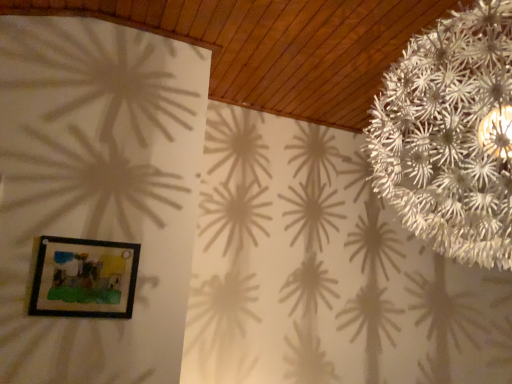
Question: Considering their positions, is wooden framed picture at lower left located in front of or behind white paper flower at upper right?

Choices:
 (A) front
 (B) behind

Answer: (B)

Question: From a real-world perspective, is wooden framed picture at lower left positioned above or below white paper flower at upper right?

Choices:
 (A) below
 (B) above

Answer: (A)

Question: Visually, is wooden framed picture at lower left positioned to the left or to the right of white paper flower at upper right?

Choices:
 (A) left
 (B) right

Answer: (A)

Question: Relative to wooden framed picture at lower left, is white paper flower at upper right in front or behind?

Choices:
 (A) front
 (B) behind

Answer: (A)

Question: In terms of width, does white paper flower at upper right look wider or thinner when compared to wooden framed picture at lower left?

Choices:
 (A) thin
 (B) wide

Answer: (B)

Question: Is white paper flower at upper right to the left or to the right of wooden framed picture at lower left in the image?

Choices:
 (A) right
 (B) left

Answer: (A)

Question: From the image's perspective, is white paper flower at upper right positioned above or below wooden framed picture at lower left?

Choices:
 (A) below
 (B) above

Answer: (B)